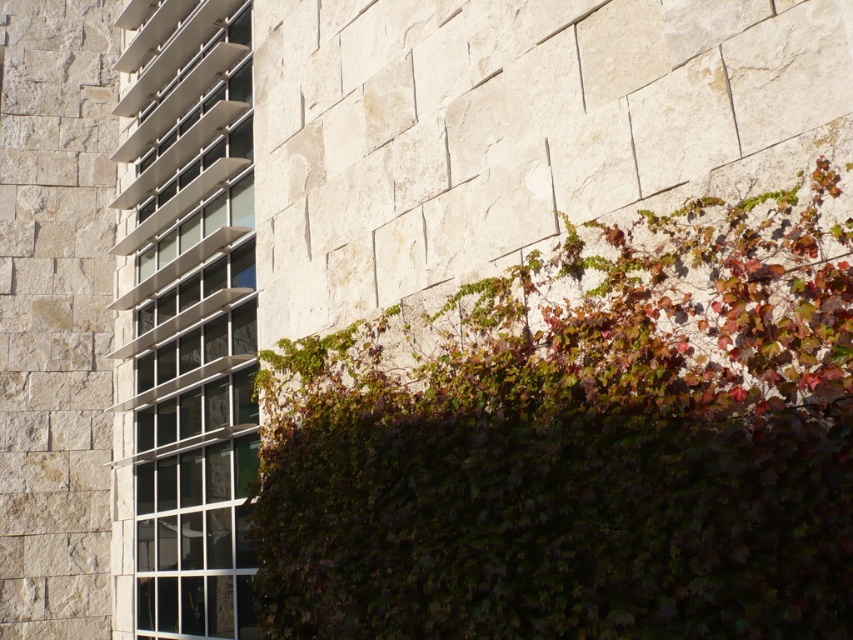
Is point (679, 365) closer to camera compared to point (201, 355)?

Yes.

Which is above, green leafy hedge at upper right or metallic glass window at left?

metallic glass window at left is above.

Image resolution: width=853 pixels, height=640 pixels. What do you see at coordinates (579, 442) in the screenshot?
I see `green leafy hedge at upper right` at bounding box center [579, 442].

Locate an element on the screen. green leafy hedge at upper right is located at coordinates (579, 442).